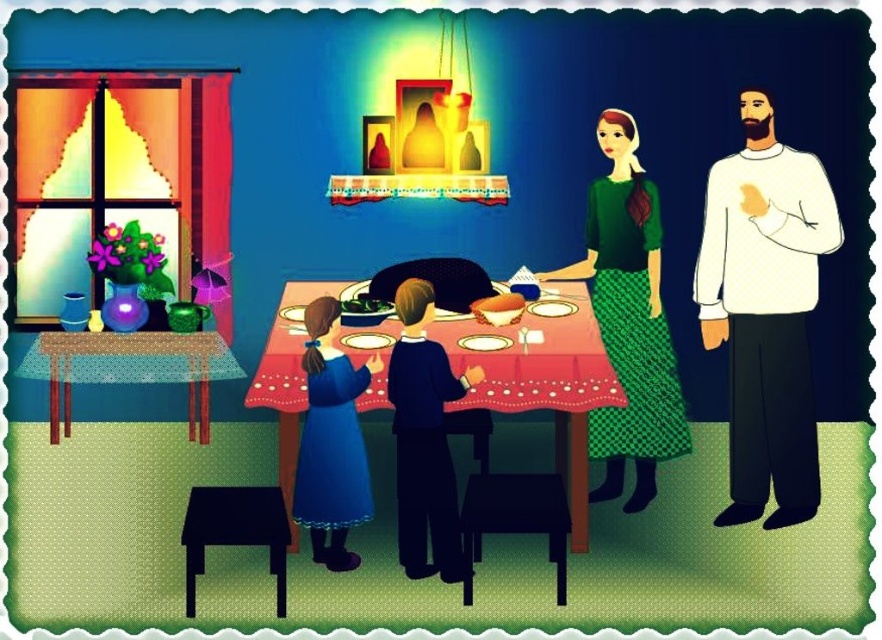
Who is positioned more to the right, green textured dress at center or blue satin dress at lower left?

green textured dress at center is more to the right.

Does point (618, 308) lie in front of point (304, 500)?

No, it is behind (304, 500).

This screenshot has height=640, width=882. What do you see at coordinates (628, 320) in the screenshot?
I see `green textured dress at center` at bounding box center [628, 320].

Locate an element on the screen. green textured dress at center is located at coordinates (628, 320).

Between white matte sweater at right and green textured dress at center, which one is positioned higher?

green textured dress at center is above.

Does white matte sweater at right appear under green textured dress at center?

Yes.

Between point (753, 108) and point (609, 122), which one is positioned in front?

Point (753, 108)

Where is `white matte sweater at right`? Image resolution: width=882 pixels, height=640 pixels. white matte sweater at right is located at coordinates point(765,310).

This screenshot has width=882, height=640. Identify the location of smooth red tablecloth at center. (542, 376).

Is smooth red tablecloth at center smaller than green leafy vegetable at table?

No, smooth red tablecloth at center is not smaller than green leafy vegetable at table.

Is point (477, 362) in front of point (363, 308)?

That is True.

The width and height of the screenshot is (882, 640). I want to click on smooth red tablecloth at center, so click(x=542, y=376).